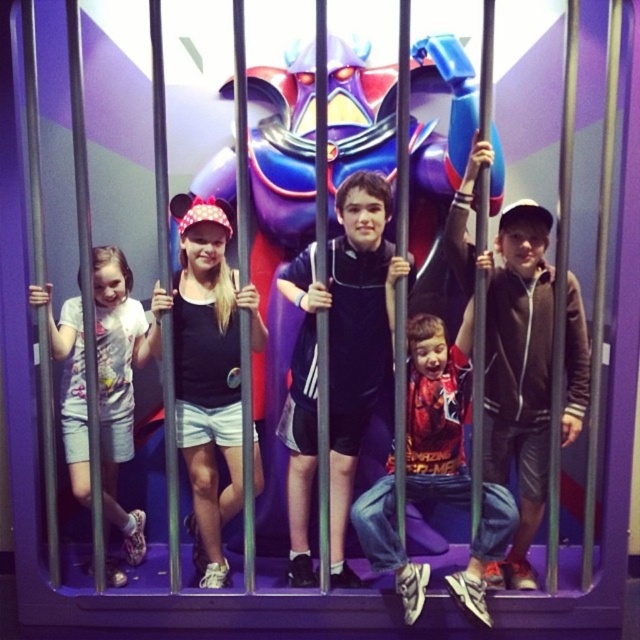
Question: Is matte black tank top at center wider than reddish-orange jersey at center?

Choices:
 (A) no
 (B) yes

Answer: (A)

Question: Which object is positioned closest to the brown fleece jacket at center?

Choices:
 (A) black matte shorts at center
 (B) glossy plastic robot at center

Answer: (B)

Question: Which of the following is the closest to the observer?

Choices:
 (A) black matte shorts at center
 (B) glossy plastic robot at center
 (C) white cotton shirt at left
 (D) reddish-orange jersey at center

Answer: (B)

Question: Among these objects, which one is farthest from the camera?

Choices:
 (A) matte black tank top at center
 (B) white cotton shirt at left

Answer: (A)

Question: Is brown fleece jacket at center bigger than black matte shorts at center?

Choices:
 (A) no
 (B) yes

Answer: (B)

Question: Can you confirm if brown fleece jacket at center is wider than reddish-orange jersey at center?

Choices:
 (A) yes
 (B) no

Answer: (B)